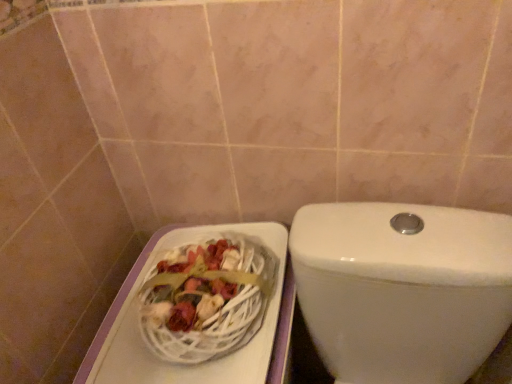
Question: Is white wicker basket at lower left to the left of white glossy toilet at center from the viewer's perspective?

Choices:
 (A) yes
 (B) no

Answer: (A)

Question: Can you confirm if white wicker basket at lower left is wider than white glossy toilet at center?

Choices:
 (A) no
 (B) yes

Answer: (A)

Question: From the image's perspective, is white wicker basket at lower left located beneath white glossy toilet at center?

Choices:
 (A) yes
 (B) no

Answer: (B)

Question: Is white wicker basket at lower left oriented away from white glossy toilet at center?

Choices:
 (A) no
 (B) yes

Answer: (A)

Question: Is the surface of white wicker basket at lower left in direct contact with white glossy toilet at center?

Choices:
 (A) yes
 (B) no

Answer: (B)

Question: Could you tell me if white wicker basket at lower left is facing white glossy toilet at center?

Choices:
 (A) no
 (B) yes

Answer: (A)

Question: Is white glossy toilet at center outside white wicker basket at lower left?

Choices:
 (A) yes
 (B) no

Answer: (A)

Question: Can you confirm if white glossy toilet at center is wider than white wicker basket at lower left?

Choices:
 (A) yes
 (B) no

Answer: (A)

Question: Could you tell me if white glossy toilet at center is facing white wicker basket at lower left?

Choices:
 (A) no
 (B) yes

Answer: (A)

Question: Is white glossy toilet at center to the left of white wicker basket at lower left from the viewer's perspective?

Choices:
 (A) yes
 (B) no

Answer: (B)

Question: Does white glossy toilet at center have a greater height compared to white wicker basket at lower left?

Choices:
 (A) yes
 (B) no

Answer: (A)

Question: From a real-world perspective, is white glossy toilet at center positioned over white wicker basket at lower left based on gravity?

Choices:
 (A) yes
 (B) no

Answer: (B)

Question: Is white wicker basket at lower left spatially inside white glossy toilet at center, or outside of it?

Choices:
 (A) outside
 (B) inside

Answer: (A)